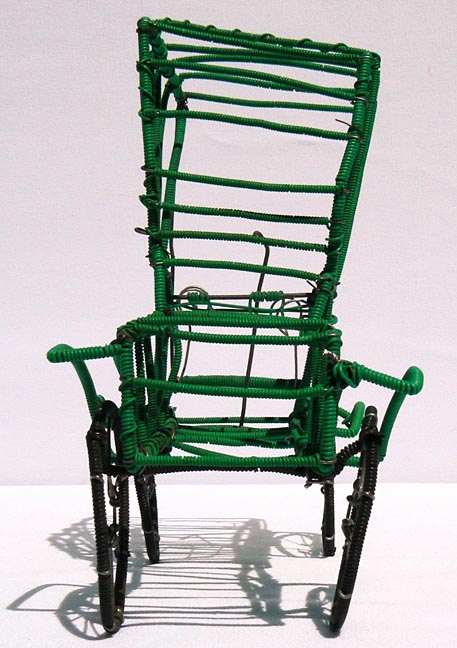
Locate an element on the screen. The image size is (457, 648). green caned horizontal bar on top of chair is located at coordinates (245, 43).